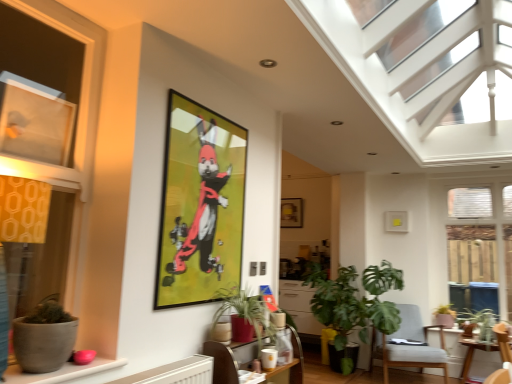
What do you see at coordinates (482, 238) in the screenshot?
I see `clear glass door at right, which ranks as the 3th window in left-to-right order` at bounding box center [482, 238].

Image resolution: width=512 pixels, height=384 pixels. What do you see at coordinates (222, 361) in the screenshot? I see `wooden table at center, marked as the second table in a back-to-front arrangement` at bounding box center [222, 361].

The image size is (512, 384). What do you see at coordinates (221, 332) in the screenshot? I see `matte ceramic pot at lower center, the 2th flowerpot from the front` at bounding box center [221, 332].

What do you see at coordinates (354, 304) in the screenshot? I see `green leafy plant at center, the second houseplant in the back-to-front sequence` at bounding box center [354, 304].

The image size is (512, 384). What do you see at coordinates (291, 213) in the screenshot?
I see `matte wooden picture frame at center, the 2th picture frame in the front-to-back sequence` at bounding box center [291, 213].

Describe the element at coordinates (245, 311) in the screenshot. I see `green leafy plant at center, positioned as the 1th houseplant in left-to-right order` at that location.

Where is `metallic gold picture frame at upper center, placed as the 2th picture frame when sorted from back to front`? The width and height of the screenshot is (512, 384). metallic gold picture frame at upper center, placed as the 2th picture frame when sorted from back to front is located at coordinates (200, 205).

Which of these two, matte wooden picture frame at center, marked as the 2th picture frame in a left-to-right arrangement, or wooden table at center, arranged as the 1th table when viewed from the left, stands shorter?

Standing shorter between the two is wooden table at center, arranged as the 1th table when viewed from the left.

Are matte wooden picture frame at center, marked as the 2th picture frame in a left-to-right arrangement, and wooden table at center, which ranks as the second table in right-to-left order, far apart?

Yes, matte wooden picture frame at center, marked as the 2th picture frame in a left-to-right arrangement, and wooden table at center, which ranks as the second table in right-to-left order, are quite far apart.

How distant is matte wooden picture frame at center, which is the 1th picture frame in right-to-left order, from wooden table at center, marked as the second table in a bottom-to-top arrangement?

They are 2.72 meters apart.

You are a GUI agent. You are given a task and a screenshot of the screen. Output one action in this format:
    pyautogui.click(x=<x>, y=<y>)
    Task: Click on the 1st window to the left when counting from the wooden table at lower right, the first table from the bottom
    The height and width of the screenshot is (384, 512).
    Given the screenshot: What is the action you would take?
    pyautogui.click(x=34, y=242)

Is wooden table at lower right, the 2th table in the top-to-bottom sequence, positioned beyond the bounds of matte glass window at left, the 3th window from the back?

Yes, wooden table at lower right, the 2th table in the top-to-bottom sequence, is outside of matte glass window at left, the 3th window from the back.

Is wooden table at lower right, the 2th table in the left-to-right sequence, oriented towards matte glass window at left, marked as the first window in a front-to-back arrangement?

Yes, wooden table at lower right, the 2th table in the left-to-right sequence, is turned towards matte glass window at left, marked as the first window in a front-to-back arrangement.

Which is behind, point (499, 345) or point (59, 266)?

The point (499, 345) is farther from the camera.

How different are the orientations of matte ceramic pot at lower center, the 2th flowerpot from the front, and matte gray window sill at lower left in degrees?

The angle between the facing direction of matte ceramic pot at lower center, the 2th flowerpot from the front, and the facing direction of matte gray window sill at lower left is 1.71 degrees.

Measure the distance between matte ceramic pot at lower center, the 2th flowerpot from the front, and matte gray window sill at lower left.

matte ceramic pot at lower center, the 2th flowerpot from the front, and matte gray window sill at lower left are 29.07 inches apart from each other.

Considering the sizes of objects matte ceramic pot at lower center, which is counted as the 2th flowerpot, starting from the bottom, and matte gray window sill at lower left in the image provided, who is bigger, matte ceramic pot at lower center, which is counted as the 2th flowerpot, starting from the bottom, or matte gray window sill at lower left?

With larger size is matte gray window sill at lower left.

Which is behind, matte ceramic pot at lower center, the 2th flowerpot from the front, or matte gray window sill at lower left?

Positioned behind is matte ceramic pot at lower center, the 2th flowerpot from the front.

From a real-world perspective, relative to green leafy plant at center, marked as the 2th houseplant in a front-to-back arrangement, is matte gray pot at lower left, marked as the 3th flowerpot in a right-to-left arrangement, vertically above or below?

In terms of real-world spatial position, matte gray pot at lower left, marked as the 3th flowerpot in a right-to-left arrangement, is above green leafy plant at center, marked as the 2th houseplant in a front-to-back arrangement.

Looking at their sizes, would you say matte gray pot at lower left, the 1th flowerpot positioned from the top, is wider or thinner than green leafy plant at center, the second houseplant from the left?

In the image, matte gray pot at lower left, the 1th flowerpot positioned from the top, appears to be more narrow than green leafy plant at center, the second houseplant from the left.

How much distance is there between matte gray pot at lower left, the 3th flowerpot from the bottom, and green leafy plant at center, the second houseplant positioned from the right?

matte gray pot at lower left, the 3th flowerpot from the bottom, and green leafy plant at center, the second houseplant positioned from the right, are 11.04 feet apart from each other.

Find the location of `the 2nd flowerpot in front of the green leafy plant at center, marked as the 2th houseplant in a front-to-back arrangement, counting from the anchor's position`. the 2nd flowerpot in front of the green leafy plant at center, marked as the 2th houseplant in a front-to-back arrangement, counting from the anchor's position is located at coordinates coord(42,344).

Is green leafy plant at center, the second houseplant in the back-to-front sequence, wider or thinner than green leafy plant at center, the third houseplant viewed from the right?

In the image, green leafy plant at center, the second houseplant in the back-to-front sequence, appears to be wider than green leafy plant at center, the third houseplant viewed from the right.

Between point (348, 292) and point (215, 322), which one is positioned in front?

Point (215, 322)

Is green leafy plant at center, marked as the 2th houseplant in a front-to-back arrangement, at the left side of green leafy plant at center, positioned as the 1th houseplant in left-to-right order?

No, green leafy plant at center, marked as the 2th houseplant in a front-to-back arrangement, is not to the left of green leafy plant at center, positioned as the 1th houseplant in left-to-right order.

Visually, is metallic gold picture frame at upper center, which appears as the 1th picture frame when viewed from the front, positioned to the left or to the right of matte glass window at left, the 3th window in the right-to-left sequence?

metallic gold picture frame at upper center, which appears as the 1th picture frame when viewed from the front, is positioned on matte glass window at left, the 3th window in the right-to-left sequence,'s right side.

Is metallic gold picture frame at upper center, which appears as the 1th picture frame when viewed from the front, located outside matte glass window at left, positioned as the 2th window in front-to-back order?

That's correct, metallic gold picture frame at upper center, which appears as the 1th picture frame when viewed from the front, is outside of matte glass window at left, positioned as the 2th window in front-to-back order.

Is metallic gold picture frame at upper center, which appears as the 1th picture frame when viewed from the front, in front of matte glass window at left, the 3th window in the right-to-left sequence?

That is False.

Does metallic gold picture frame at upper center, placed as the 2th picture frame when sorted from back to front, have a lesser width compared to matte glass window at left, which ranks as the 1th window in left-to-right order?

Indeed, metallic gold picture frame at upper center, placed as the 2th picture frame when sorted from back to front, has a lesser width compared to matte glass window at left, which ranks as the 1th window in left-to-right order.

Is green leafy plant at center, the 3th houseplant from the back, beside matte glass window at left, which ranks as the 1th window in left-to-right order?

No, green leafy plant at center, the 3th houseplant from the back, is not next to matte glass window at left, which ranks as the 1th window in left-to-right order.

From a real-world perspective, is green leafy plant at center, the third houseplant viewed from the right, positioned above or below matte glass window at left, the 2th window when ordered from back to front?

Clearly, from a real-world perspective, green leafy plant at center, the third houseplant viewed from the right, is below matte glass window at left, the 2th window when ordered from back to front.

From the image's perspective, count 1st houseplants downward from the matte glass window at left, positioned as the 2th window in front-to-back order, and point to it. Please provide its 2D coordinates.

[(245, 311)]

Which is nearer, (242, 334) or (16, 175)?

Positioned in front is point (16, 175).

From a real-world perspective, count 2nd picture frames upward from the wooden table at center, marked as the second table in a back-to-front arrangement, and point to it. Please provide its 2D coordinates.

[(291, 213)]

Which window is the 1st one when counting from the left side of the wooden table at lower right, the 2th table in the top-to-bottom sequence? Please provide its 2D coordinates.

[(34, 242)]

Which object lies nearer to the anchor point wooden table at center, arranged as the 1th table when viewed from the left, matte brown flowerpot at lower right, which is counted as the 3th flowerpot, starting from the left, or green leafy plant at center, positioned as the 1th houseplant in left-to-right order?

Among the two, green leafy plant at center, positioned as the 1th houseplant in left-to-right order, is located nearer to wooden table at center, arranged as the 1th table when viewed from the left.

Looking at the image, which one is located further to clear glass door at right, the 1th window viewed from the back, light gray fabric chair at lower right or metallic gold picture frame at upper center, the 2th picture frame in the right-to-left sequence?

metallic gold picture frame at upper center, the 2th picture frame in the right-to-left sequence.

Which object lies further to the anchor point matte glass window at left, which ranks as the second window in right-to-left order, wooden table at lower right, the first table positioned from the right, or matte brown flowerpot at lower right, the 1th flowerpot from the bottom?

wooden table at lower right, the first table positioned from the right, is positioned further to the anchor matte glass window at left, which ranks as the second window in right-to-left order.

Based on their spatial positions, is matte wooden picture frame at center, which is the 1th picture frame in right-to-left order, or wooden table at lower right, the 2th table in the top-to-bottom sequence, closer to wooden table at center, marked as the second table in a back-to-front arrangement?

matte wooden picture frame at center, which is the 1th picture frame in right-to-left order, lies closer to wooden table at center, marked as the second table in a back-to-front arrangement, than the other object.

When comparing their distances from clear glass door at right, the 3th window when ordered from front to back, does matte ceramic pot at lower center, which appears as the second flowerpot when viewed from the top, or matte gray pot at lower left, the 3th flowerpot from the bottom, seem closer?

Based on the image, matte ceramic pot at lower center, which appears as the second flowerpot when viewed from the top, appears to be nearer to clear glass door at right, the 3th window when ordered from front to back.

Estimate the real-world distances between objects in this image. Which object is closer to green leafy plant at center, marked as the 2th houseplant in a front-to-back arrangement, metallic gold picture frame at upper center, placed as the 1th picture frame when sorted from left to right, or matte ceramic pot at lower center, the 2th flowerpot from the front?

metallic gold picture frame at upper center, placed as the 1th picture frame when sorted from left to right, is positioned closer to the anchor green leafy plant at center, marked as the 2th houseplant in a front-to-back arrangement.

Based on their spatial positions, is clear glass door at right, the 1th window viewed from the back, or matte gray window sill at lower left closer to green matte plant at right, which is the first houseplant in back-to-front order?

clear glass door at right, the 1th window viewed from the back.

Looking at the image, which one is located closer to wooden table at lower right, the first table positioned from the right, clear glass door at right, the 1th window viewed from the back, or matte ceramic pot at lower center, the second flowerpot viewed from the right?

clear glass door at right, the 1th window viewed from the back, is positioned closer to the anchor wooden table at lower right, the first table positioned from the right.

This screenshot has height=384, width=512. Identify the location of window sill between metallic gold picture frame at upper center, which appears as the 1th picture frame when viewed from the front, and wooden table at center, placed as the 1th table when sorted from front to back, in the vertical direction. (62, 372).

Identify the location of flowerpot between metallic gold picture frame at upper center, placed as the 2th picture frame when sorted from back to front, and green leafy plant at center, the second houseplant in the back-to-front sequence, from front to back. (221, 332).

At what (x,y) coordinates should I click in order to perform the action: click on flowerpot between matte glass window at left, marked as the first window in a front-to-back arrangement, and metallic gold picture frame at upper center, which appears as the 1th picture frame when viewed from the front, in the front-back direction. Please return your answer as a coordinate pair (x, y). Looking at the image, I should click on (42, 344).

Find the location of a particular element. window between matte glass window at left, which ranks as the 1th window in left-to-right order, and metallic gold picture frame at upper center, the 2th picture frame in the right-to-left sequence, from left to right is located at coordinates (34, 242).